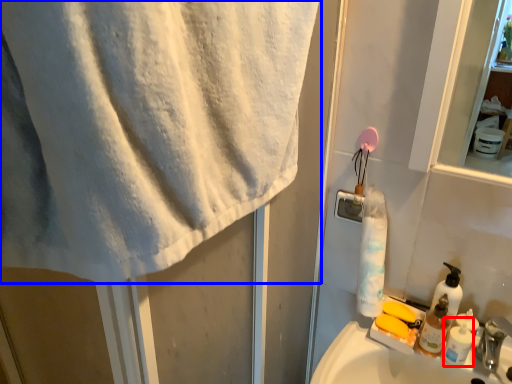
Question: Which point is further to the camera, shaving cream (highlighted by a red box) or towel (highlighted by a blue box)?

Choices:
 (A) shaving cream
 (B) towel

Answer: (A)